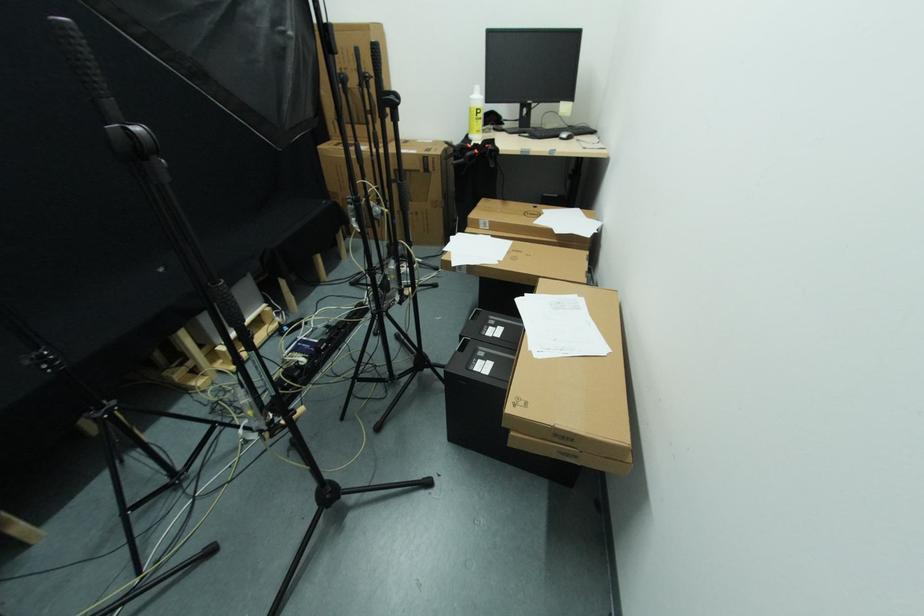
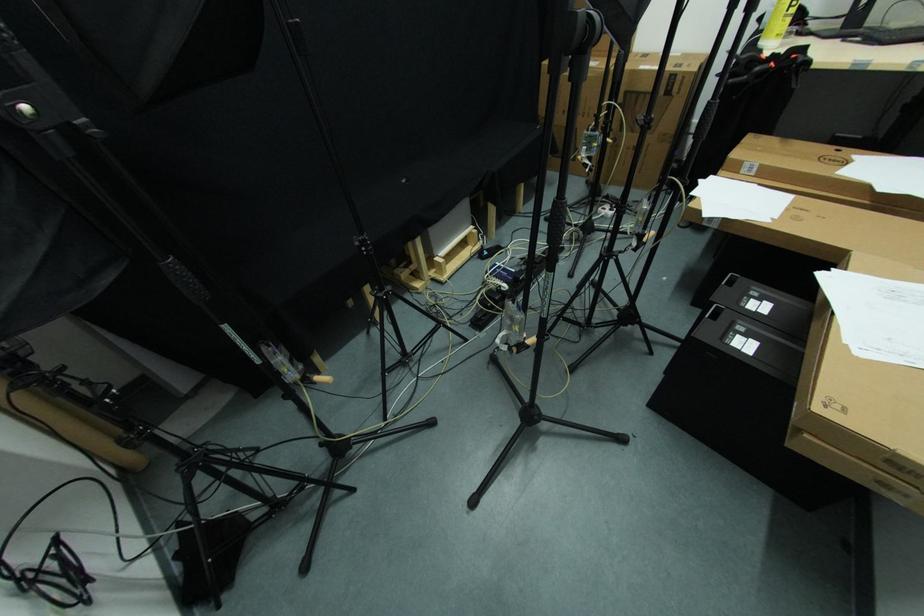
Find the pixel in the second image that matches the point at 341,377 in the first image.

(535, 310)